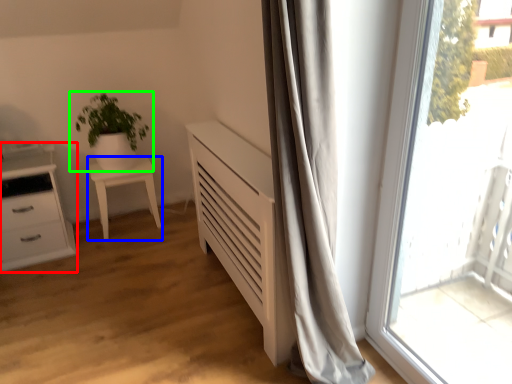
Question: Based on their relative distances, which object is farther from chest of drawers (highlighted by a red box)? Choose from furniture (highlighted by a blue box) and houseplant (highlighted by a green box).

Choices:
 (A) furniture
 (B) houseplant

Answer: (B)